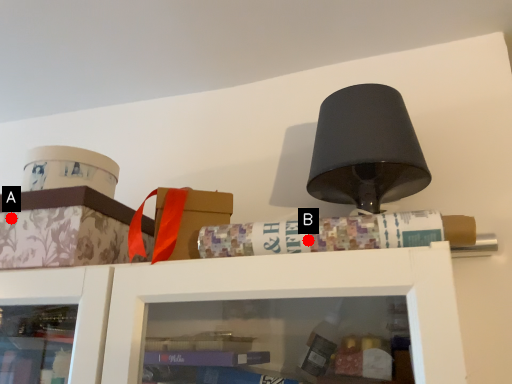
Question: Two points are circled on the image, labeled by A and B beside each circle. Which point is closer to the camera?

Choices:
 (A) A is closer
 (B) B is closer

Answer: (B)